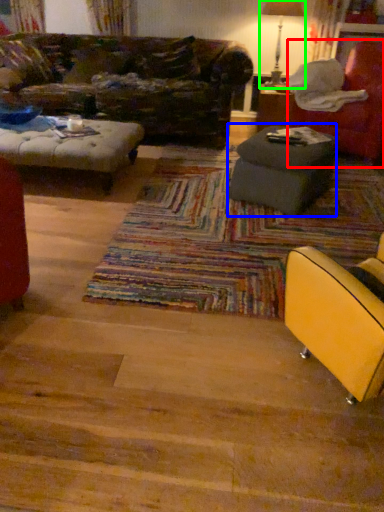
Question: Which is farther away from chair (highlighted by a red box)? table (highlighted by a blue box) or table lamp (highlighted by a green box)?

Choices:
 (A) table
 (B) table lamp

Answer: (B)